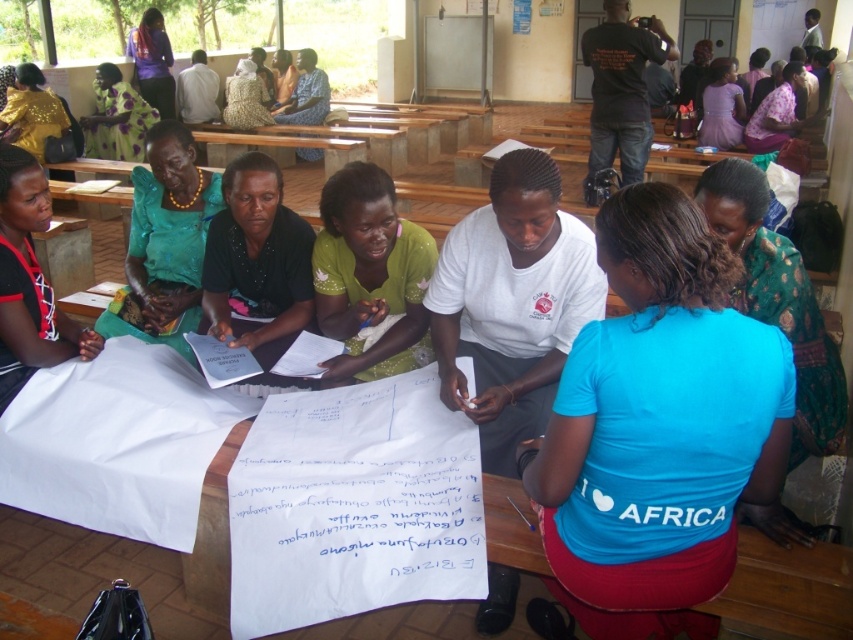
Question: Can you confirm if black-and-red woven cloth at lower left is thinner than purple satin dress at upper right?

Choices:
 (A) no
 (B) yes

Answer: (B)

Question: Is white paper at center above black-and-red woven cloth at lower left?

Choices:
 (A) yes
 (B) no

Answer: (B)

Question: Among these objects, which one is farthest from the camera?

Choices:
 (A) green fabric shirt at center
 (B) printed floral dress at upper left

Answer: (B)

Question: Can you confirm if green sequined dress at center is positioned to the left of shiny gold sequined blouse at upper left?

Choices:
 (A) no
 (B) yes

Answer: (A)

Question: Which object is the farthest from the shiny gold sequined blouse at upper left?

Choices:
 (A) purple satin dress at upper right
 (B) green fabric shirt at center
 (C) black cotton shirt at upper right

Answer: (A)

Question: Which of these objects is positioned closest to the purple fabric at upper left?

Choices:
 (A) purple satin dress at upper right
 (B) green sequined dress at center

Answer: (A)